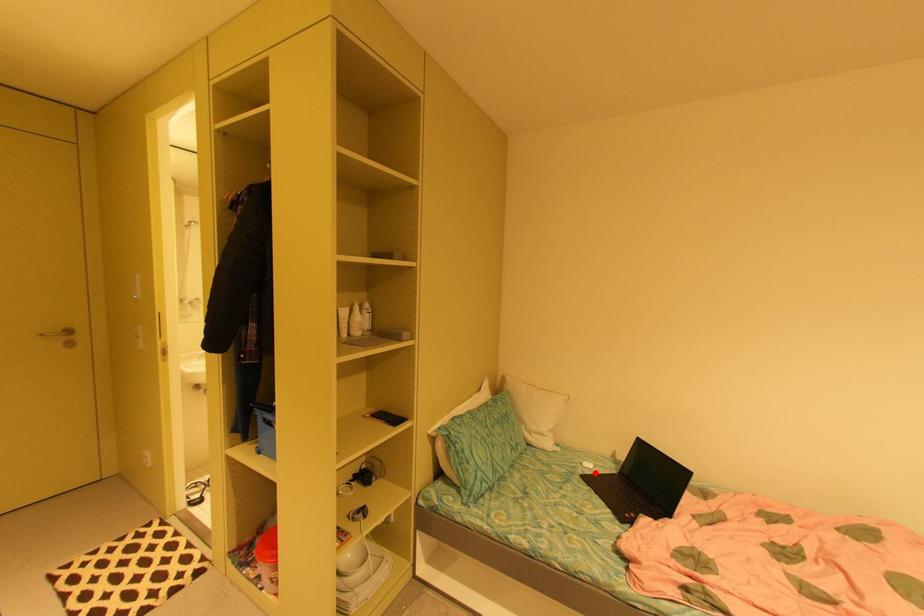
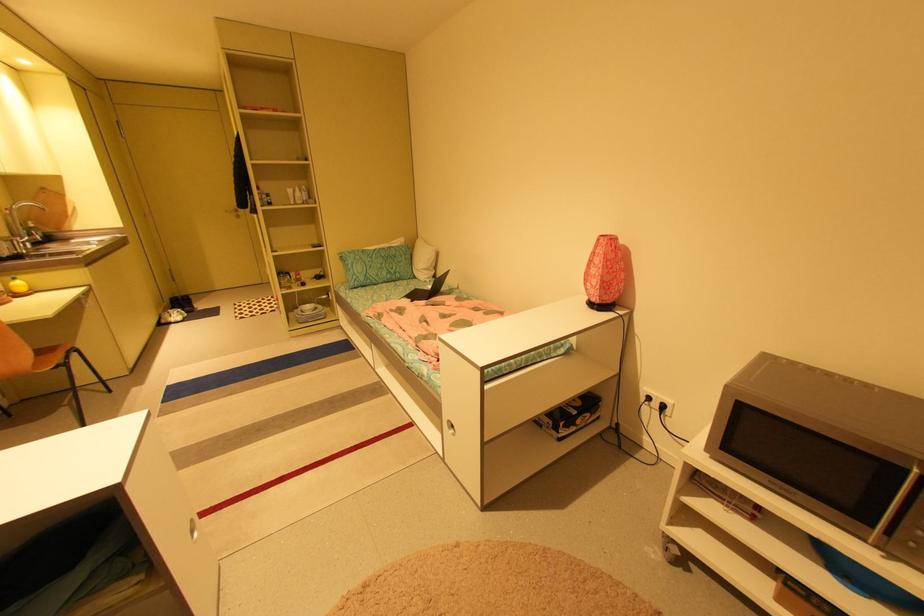
The point at the highlighted location is marked in the first image. Where is the corresponding point in the second image?

(431, 290)